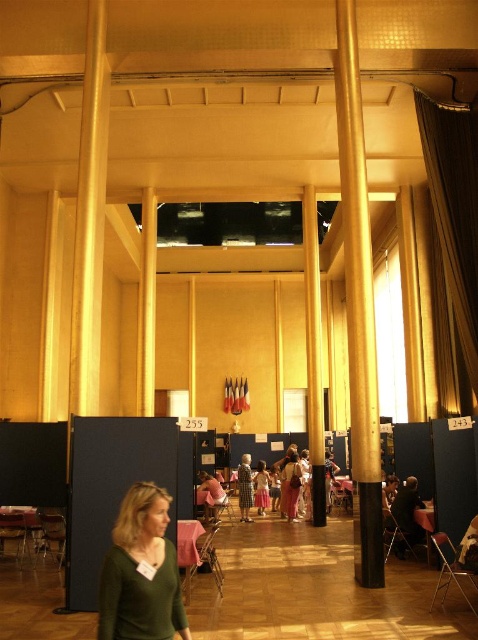
You are an event planner setting up the venue. You notice the gold fabric curtain at right and the pink fabric dress at center. Which object is placed in front of the other?

The gold fabric curtain at right is positioned over the pink fabric dress at center, meaning it is in front of the dress.

You are standing in the hall and notice a gold polished pillar at center and a pink fabric dress at center. Which object is taller?

The gold polished pillar at center is taller than the pink fabric dress at center.

You are standing at the point labeled 255 in the hall. There are two points marked in the image, point (x=315, y=362) and point (x=259, y=515). Which point is closer to you?

Point (x=315, y=362) is in front of point (x=259, y=515), so it is closer to you.